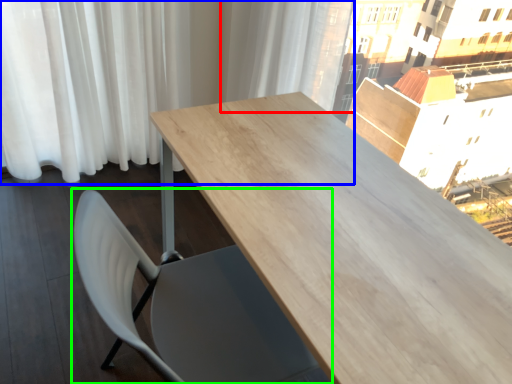
Question: Which is nearer to the curtain (highlighted by a red box)? curtain (highlighted by a blue box) or chair (highlighted by a green box).

Choices:
 (A) curtain
 (B) chair

Answer: (A)